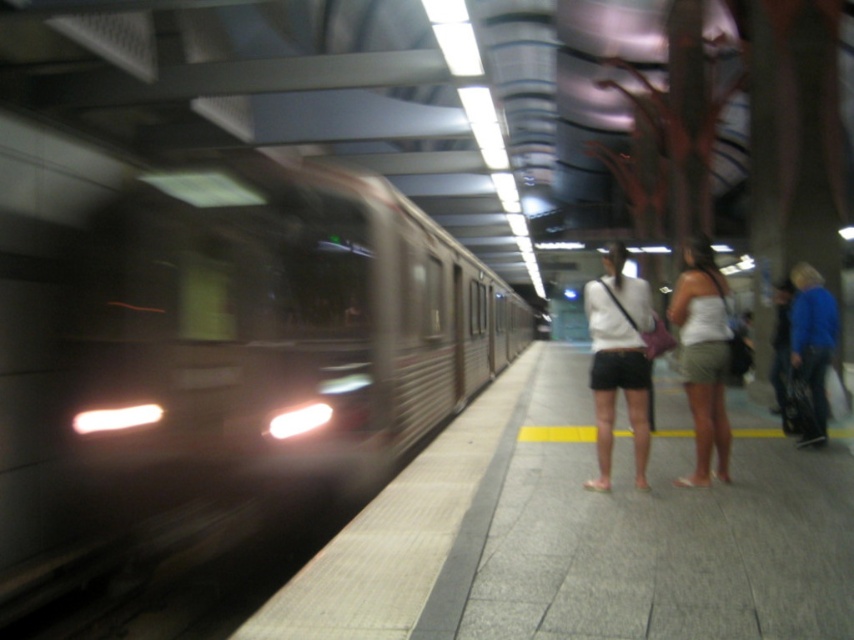
Question: Which of the following is the closest to the observer?

Choices:
 (A) (718, 381)
 (B) (800, 346)
 (C) (624, 499)

Answer: (C)

Question: Which of the following is the farthest from the observer?

Choices:
 (A) (718, 376)
 (B) (383, 588)
 (C) (817, 323)

Answer: (C)

Question: Does white matte shorts at center appear over white cotton tank top at center?

Choices:
 (A) no
 (B) yes

Answer: (B)

Question: Does gray concrete platform at center appear under blue denim jeans at right?

Choices:
 (A) no
 (B) yes

Answer: (B)

Question: Can you confirm if gray concrete platform at center is positioned to the left of white cotton tank top at center?

Choices:
 (A) no
 (B) yes

Answer: (B)

Question: Considering the real-world distances, which object is farthest from the gray concrete platform at center?

Choices:
 (A) white matte shorts at center
 (B) white cotton tank top at center

Answer: (A)